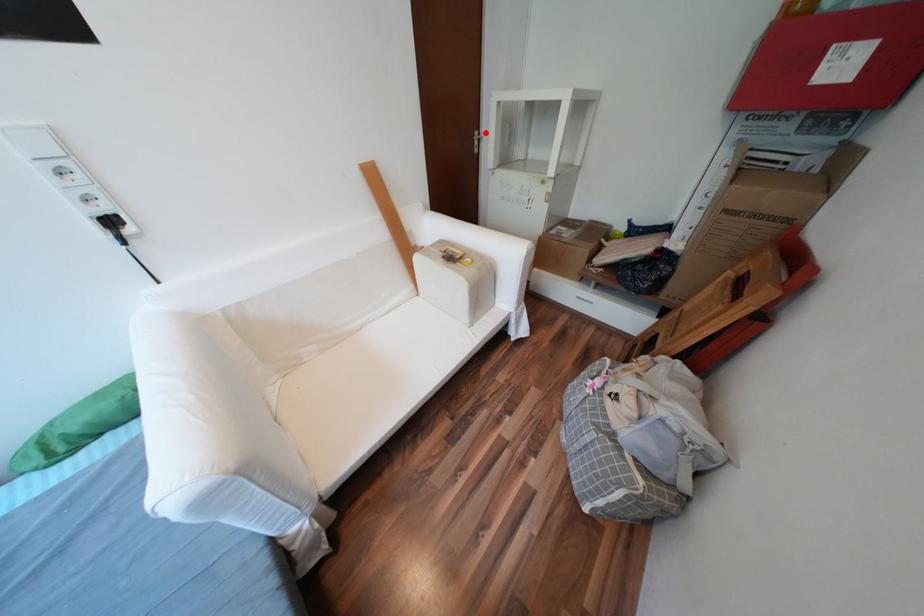
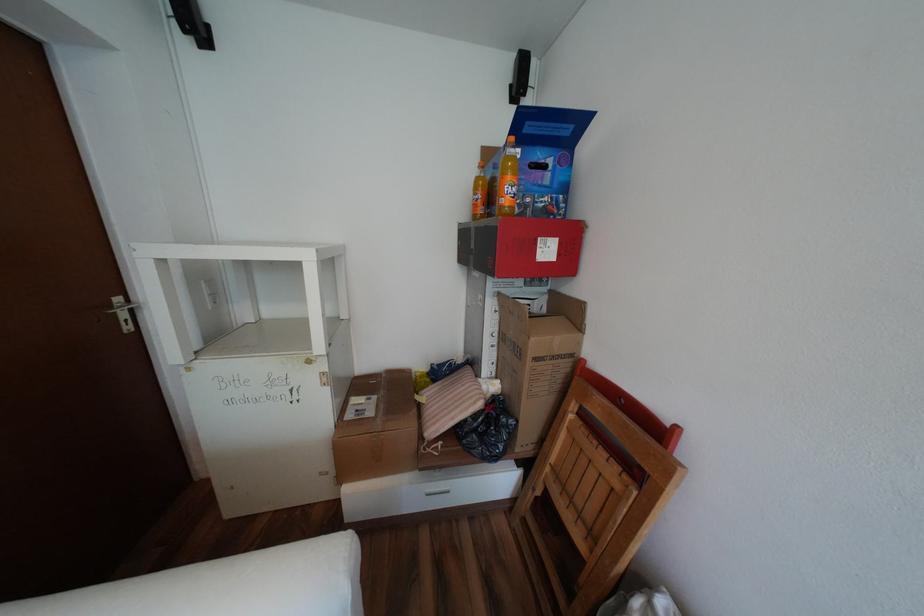
In the second image, find the point that corresponds to the highlighted location in the first image.

(128, 299)